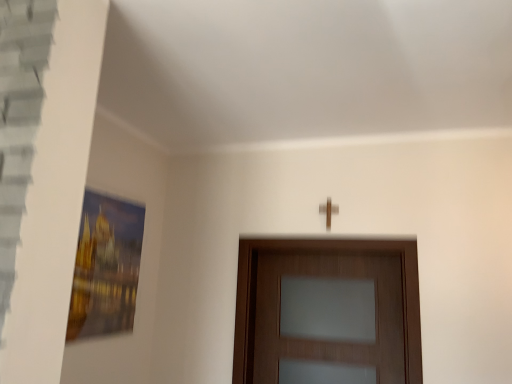
Question: Is wooden door at center completely or partially inside wooden cross at upper center?

Choices:
 (A) no
 (B) yes

Answer: (A)

Question: Does wooden cross at upper center come behind wooden door at center?

Choices:
 (A) no
 (B) yes

Answer: (B)

Question: Is wooden cross at upper center positioned beyond the bounds of wooden door at center?

Choices:
 (A) yes
 (B) no

Answer: (A)

Question: From a real-world perspective, is wooden cross at upper center positioned under wooden door at center based on gravity?

Choices:
 (A) no
 (B) yes

Answer: (A)

Question: Considering the relative positions of wooden cross at upper center and wooden door at center in the image provided, is wooden cross at upper center to the left of wooden door at center from the viewer's perspective?

Choices:
 (A) yes
 (B) no

Answer: (B)

Question: Considering the relative sizes of wooden cross at upper center and wooden door at center in the image provided, is wooden cross at upper center smaller than wooden door at center?

Choices:
 (A) no
 (B) yes

Answer: (B)

Question: Can you confirm if wooden door at center is bigger than wooden cross at upper center?

Choices:
 (A) yes
 (B) no

Answer: (A)

Question: Is wooden door at center turned away from wooden cross at upper center?

Choices:
 (A) no
 (B) yes

Answer: (A)

Question: Is wooden door at center directly adjacent to wooden cross at upper center?

Choices:
 (A) no
 (B) yes

Answer: (A)

Question: Does wooden door at center have a smaller size compared to wooden cross at upper center?

Choices:
 (A) no
 (B) yes

Answer: (A)

Question: Considering the relative sizes of wooden door at center and wooden cross at upper center in the image provided, is wooden door at center wider than wooden cross at upper center?

Choices:
 (A) no
 (B) yes

Answer: (B)

Question: From a real-world perspective, is wooden door at center below wooden cross at upper center?

Choices:
 (A) yes
 (B) no

Answer: (A)

Question: Is point click(x=336, y=271) closer or farther from the camera than point click(x=324, y=205)?

Choices:
 (A) closer
 (B) farther

Answer: (B)